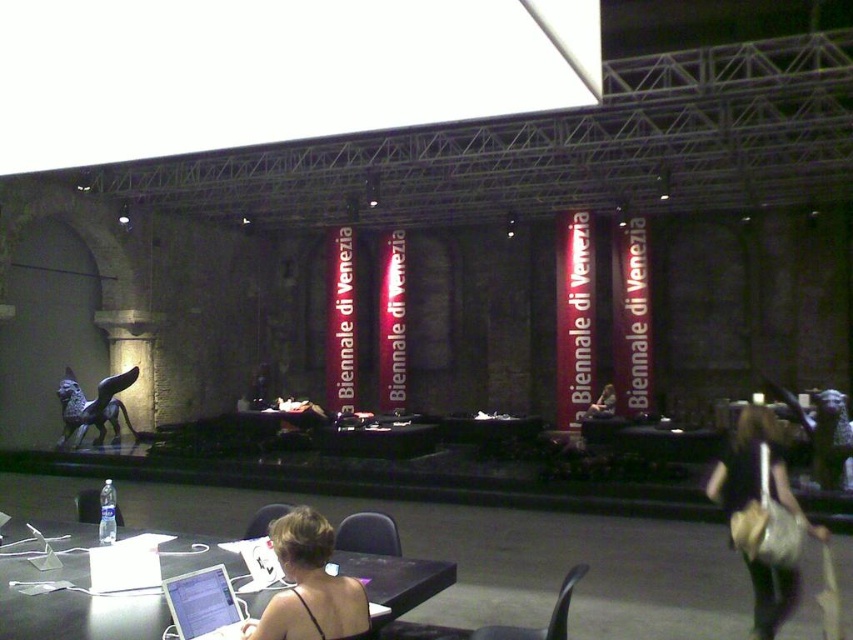
Question: Which object is positioned farthest from the metallic gray chair at center?

Choices:
 (A) leather handbag at lower right
 (B) matte black chair at center
 (C) metallic gray table at center

Answer: (C)

Question: Is silver metallic laptop at lower left to the left of black plastic chair at center from the viewer's perspective?

Choices:
 (A) no
 (B) yes

Answer: (B)

Question: Does black fabric hair at center appear over matte black laptop at center?

Choices:
 (A) yes
 (B) no

Answer: (A)

Question: Estimate the real-world distances between objects in this image. Which object is closer to the matte black laptop at center?

Choices:
 (A) black plastic chair at center
 (B) matte black chair at center
 (C) metallic gray table at center
 (D) silver metallic laptop at lower left

Answer: (A)

Question: Considering the real-world distances, which object is closest to the black plastic chair at center?

Choices:
 (A) matte black chair at center
 (B) matte black laptop at center
 (C) leather handbag at lower right

Answer: (A)

Question: Is black plastic chair at lower center bigger than matte black laptop at center?

Choices:
 (A) no
 (B) yes

Answer: (A)